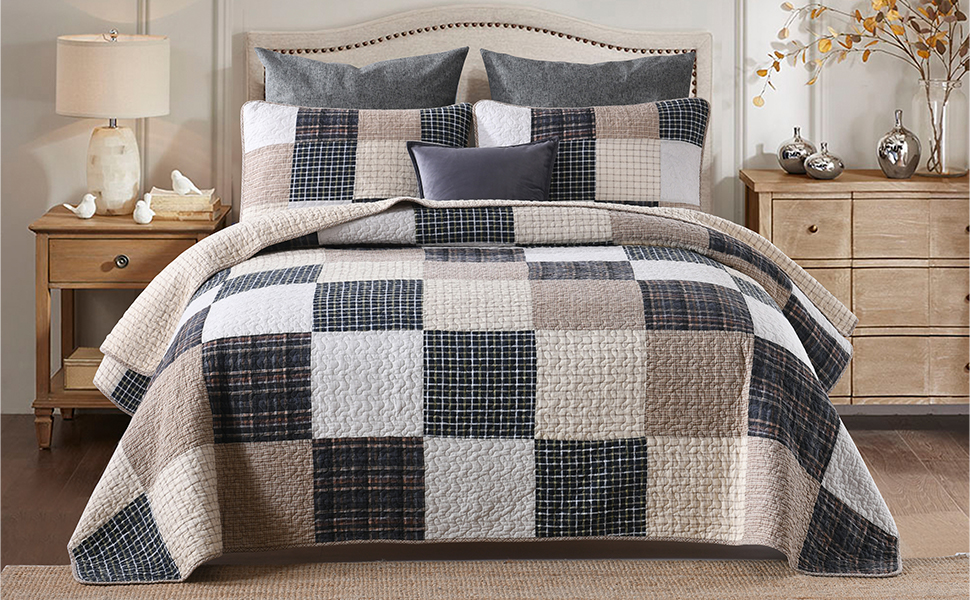
The image size is (970, 600). Identify the location of small bedside table. (72, 265).